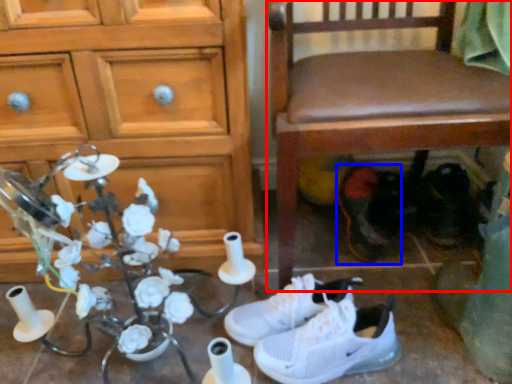
Question: Among these objects, which one is nearest to the camera, chair (highlighted by a red box) or footwear (highlighted by a blue box)?

Choices:
 (A) chair
 (B) footwear

Answer: (A)